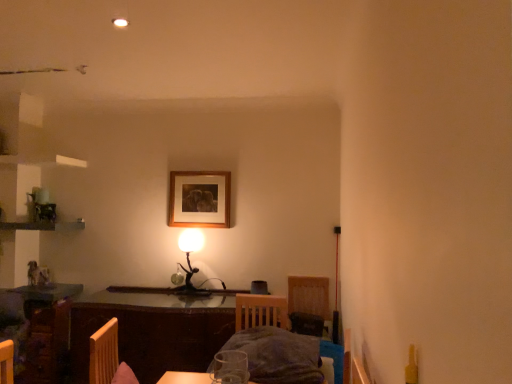
At what (x,y) coordinates should I click in order to perform the action: click on free spot below metallic gold table lamp at center (from a real-world perspective). Please return your answer as a coordinate pair (x, y). The width and height of the screenshot is (512, 384). Looking at the image, I should click on (196, 295).